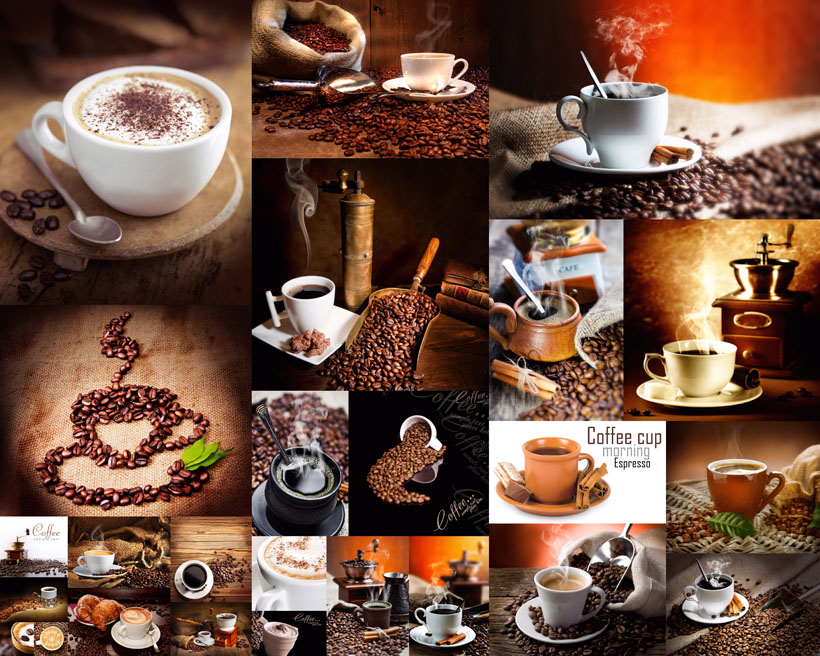
Locate an element on the screen. The height and width of the screenshot is (656, 820). coffee grinder is located at coordinates (366, 234), (362, 569), (749, 294), (467, 571).